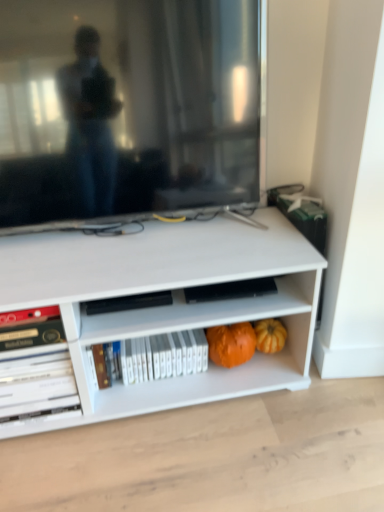
Identify the location of free space in front of orange matte pumpkin at lower center, the second pumpkin viewed from the right. (226, 406).